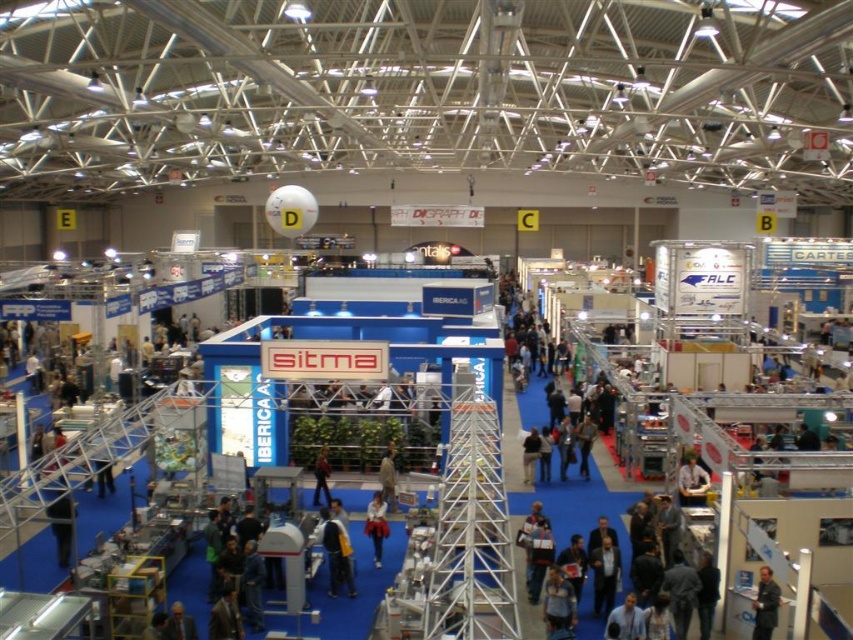
Which is below, dark blue jacket at center or dark blue shirt at center?

dark blue shirt at center is lower down.

Is dark blue jacket at center positioned before dark blue shirt at center?

No.

I want to click on dark blue jacket at center, so click(335, 554).

Who is positioned more to the right, brown leather jacket at center or dark blue jeans at center?

Positioned to the right is brown leather jacket at center.

Looking at this image, which of these two, brown leather jacket at center or dark blue jeans at center, stands taller?

Standing taller between the two is dark blue jeans at center.

Is point (386, 467) positioned after point (328, 500)?

No.

Identify the location of brown leather jacket at center. The width and height of the screenshot is (853, 640). (387, 477).

Between white fabric shirt at center and dark blue jeans at center, which one is positioned higher?

Positioned higher is dark blue jeans at center.

Who is shorter, white fabric shirt at center or dark blue jeans at center?

white fabric shirt at center

You are a GUI agent. You are given a task and a screenshot of the screen. Output one action in this format:
    pyautogui.click(x=<x>, y=<y>)
    Task: Click on the white fabric shirt at center
    
    Given the screenshot: What is the action you would take?
    pyautogui.click(x=376, y=525)